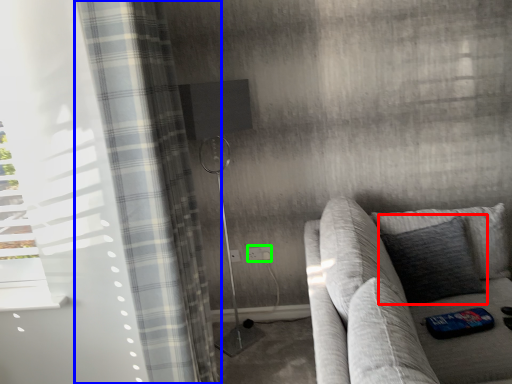
Question: Based on their relative distances, which object is nearer to pillow (highlighted by a red box)? Choose from curtain (highlighted by a blue box) and electric outlet (highlighted by a green box).

Choices:
 (A) curtain
 (B) electric outlet

Answer: (B)